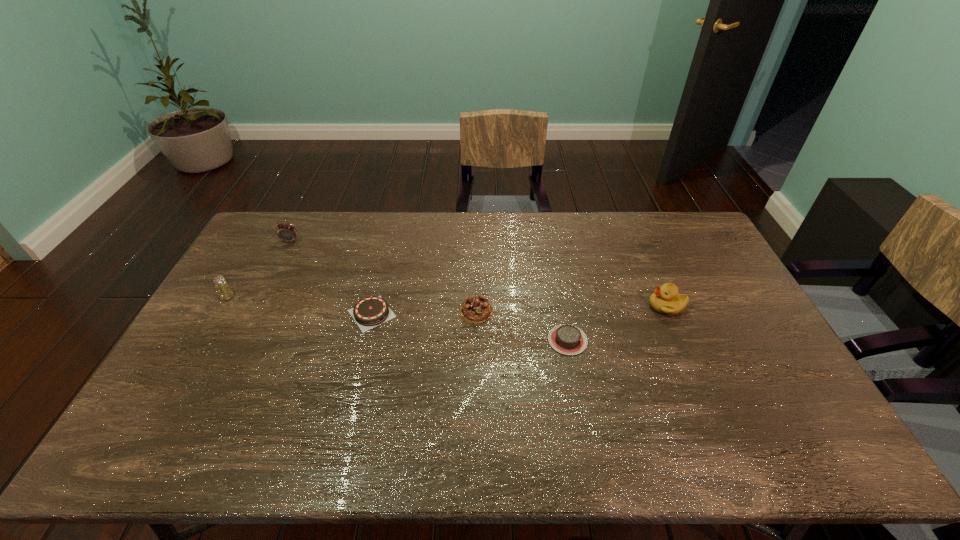
Select which chocolate cake appears as the second closest to the farthest object. Please provide its 2D coordinates. Your answer should be formatted as a tuple, i.e. [(x, y)], where the tuple contains the x and y coordinates of a point satisfying the conditions above.

[(476, 309)]

Identify which chocolate cake is located as the nearest to the rightmost object. Please provide its 2D coordinates. Your answer should be formatted as a tuple, i.e. [(x, y)], where the tuple contains the x and y coordinates of a point satisfying the conditions above.

[(567, 339)]

The image size is (960, 540). What are the coordinates of `vacant space that satisfies the following two spatial constraints: 1. on the face of the farthest object; 2. on the left side of the leftmost chocolate cake` in the screenshot? It's located at (253, 313).

I want to click on vacant area in the image that satisfies the following two spatial constraints: 1. on the front side of the shortest chocolate cake; 2. on the right side of the tallest chocolate cake, so click(x=475, y=340).

Where is `vacant area in the image that satisfies the following two spatial constraints: 1. on the front-facing side of the rightmost object; 2. on the front side of the shortest object`? vacant area in the image that satisfies the following two spatial constraints: 1. on the front-facing side of the rightmost object; 2. on the front side of the shortest object is located at coordinates (681, 340).